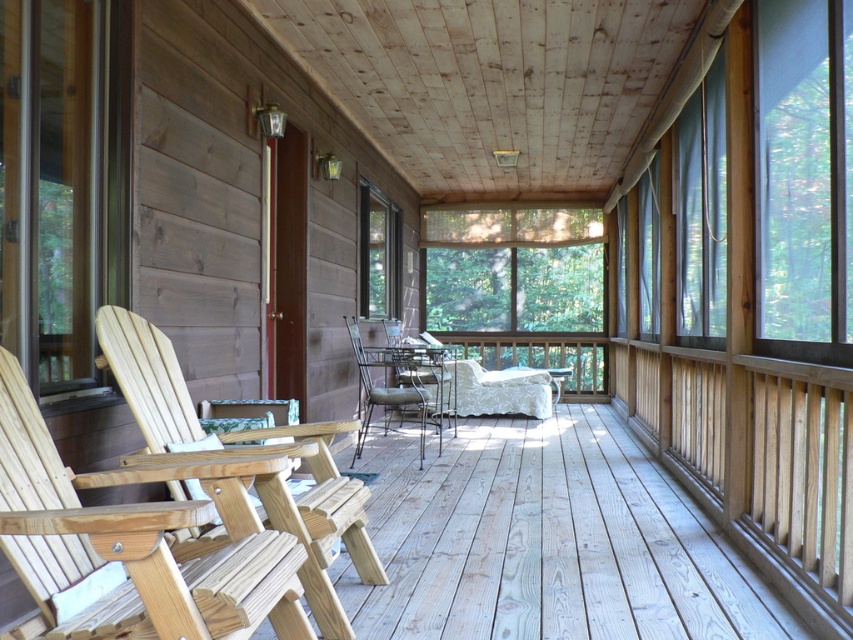
Question: Is metallic silver chair at center to the left of metallic wire chair at center from the viewer's perspective?

Choices:
 (A) no
 (B) yes

Answer: (B)

Question: Which point is farther from the camera taking this photo?

Choices:
 (A) (438, 378)
 (B) (173, 426)
 (C) (368, 419)

Answer: (A)

Question: In this image, where is light brown wood chair at left located relative to metallic wire chair at center?

Choices:
 (A) above
 (B) below

Answer: (A)

Question: Does light brown wood chair at left appear on the right side of metallic silver chair at center?

Choices:
 (A) yes
 (B) no

Answer: (B)

Question: Which point is closer to the camera taking this photo?

Choices:
 (A) (396, 388)
 (B) (309, 540)
 (C) (434, 410)

Answer: (B)

Question: Which of the following is the farthest from the observer?

Choices:
 (A) metallic wire chair at center
 (B) light brown wood chair at left

Answer: (A)